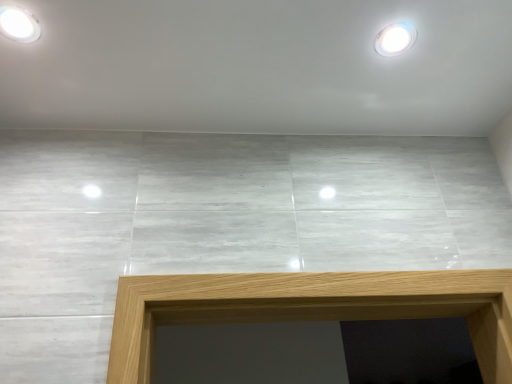
The width and height of the screenshot is (512, 384). Describe the element at coordinates (259, 67) in the screenshot. I see `white marble tiles at upper center` at that location.

Find the location of a particular element. The width and height of the screenshot is (512, 384). white marble tiles at upper center is located at coordinates (259, 67).

Image resolution: width=512 pixels, height=384 pixels. Find the location of `white marble tiles at upper center`. white marble tiles at upper center is located at coordinates (259, 67).